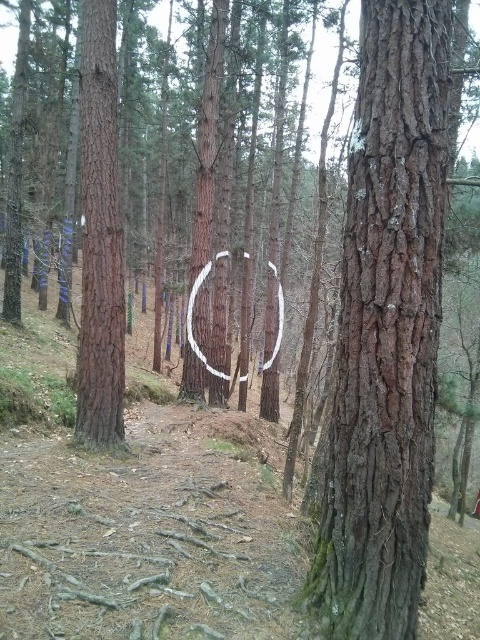
You are a hiker who wants to place a 2 meter long wooden bench between the smooth brown bark at center and the white painted wood horseshoe at center. Is there enough space for the bench?

The smooth brown bark at center is 7.62 meters from the white painted wood horseshoe at center. Since the bench is 2 meters long, there is sufficient space between them to place the bench.

From the picture: You are a hiker trying to identify landmarks. You see a smooth brown bark at center and a brown rough tree trunk at left. Which tree is shorter?

The smooth brown bark at center is not as tall as the brown rough tree trunk at left, so the smooth brown bark at center is shorter.

You are on a nature walk and see both the smooth brown bark at center and the white painted wood horseshoe at center. Which object is positioned to the right of the other?

The smooth brown bark at center is to the right of the white painted wood horseshoe at center.